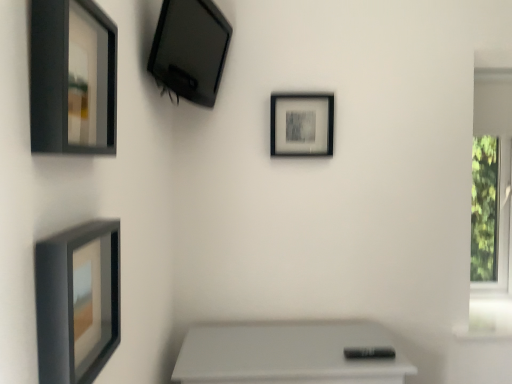
Question: Does matte black tv at upper left, positioned as the 3th picture frame in front-to-back order, have a smaller size compared to white plastic window frame at right?

Choices:
 (A) yes
 (B) no

Answer: (B)

Question: Is matte black tv at upper left, positioned as the 3th picture frame in front-to-back order, placed right next to white plastic window frame at right?

Choices:
 (A) yes
 (B) no

Answer: (B)

Question: Does matte black tv at upper left, acting as the 2th picture frame starting from the back, have a larger size compared to white plastic window frame at right?

Choices:
 (A) yes
 (B) no

Answer: (A)

Question: Is matte black tv at upper left, placed as the 2th picture frame when sorted from right to left, far from white plastic window frame at right?

Choices:
 (A) no
 (B) yes

Answer: (B)

Question: Does matte black tv at upper left, the 1th picture frame when ordered from top to bottom, have a lesser width compared to white plastic window frame at right?

Choices:
 (A) yes
 (B) no

Answer: (B)

Question: Could you tell me if matte black tv at upper left, positioned as the 3th picture frame in front-to-back order, is facing white plastic window frame at right?

Choices:
 (A) no
 (B) yes

Answer: (A)

Question: Is matte black tv at upper left, positioned as the 3th picture frame in front-to-back order, facing away from matte black picture frame at center, which ranks as the fourth picture frame in front-to-back order?

Choices:
 (A) no
 (B) yes

Answer: (A)

Question: Is matte black tv at upper left, the 1th picture frame when ordered from top to bottom, taller than matte black picture frame at center, the 1th picture frame positioned from the right?

Choices:
 (A) yes
 (B) no

Answer: (A)

Question: Is matte black tv at upper left, placed as the 2th picture frame when sorted from right to left, positioned in front of matte black picture frame at center, the 1th picture frame in the back-to-front sequence?

Choices:
 (A) yes
 (B) no

Answer: (A)

Question: Is matte black tv at upper left, positioned as the 3th picture frame in front-to-back order, not near matte black picture frame at center, the 1th picture frame in the back-to-front sequence?

Choices:
 (A) no
 (B) yes

Answer: (A)

Question: From a real-world perspective, is matte black tv at upper left, placed as the 2th picture frame when sorted from right to left, below matte black picture frame at center, placed as the second picture frame when sorted from top to bottom?

Choices:
 (A) yes
 (B) no

Answer: (B)

Question: Is matte black tv at upper left, acting as the 2th picture frame starting from the back, behind matte black picture frame at center, the 1th picture frame positioned from the right?

Choices:
 (A) yes
 (B) no

Answer: (B)

Question: From a real-world perspective, is matte black picture frame at lower left, the second picture frame positioned from the front, on top of matte black tv at upper left, placed as the 2th picture frame when sorted from right to left?

Choices:
 (A) no
 (B) yes

Answer: (A)